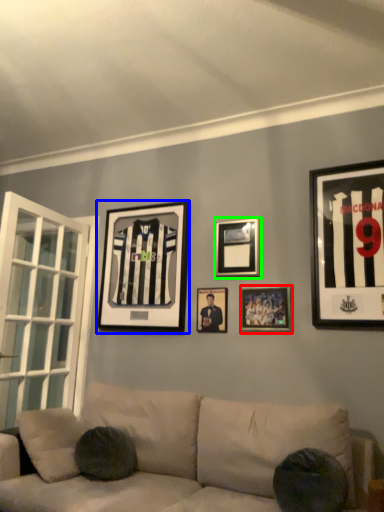
Question: Considering the real-world distances, which object is closest to picture frame (highlighted by a red box)? picture frame (highlighted by a blue box) or picture frame (highlighted by a green box).

Choices:
 (A) picture frame
 (B) picture frame

Answer: (B)